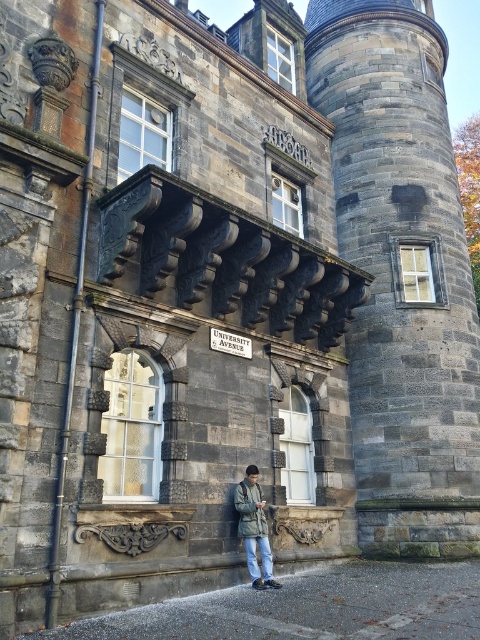
Question: Among these objects, which one is nearest to the camera?

Choices:
 (A) green matte jacket at center
 (B) dark gray stone tower at center

Answer: (A)

Question: Can you confirm if dark gray stone tower at center is wider than green matte jacket at center?

Choices:
 (A) no
 (B) yes

Answer: (B)

Question: Which point appears farthest from the camera in this image?

Choices:
 (A) (242, 484)
 (B) (359, 60)

Answer: (B)

Question: Is dark gray stone tower at center bigger than green matte jacket at center?

Choices:
 (A) no
 (B) yes

Answer: (B)

Question: From the image, what is the correct spatial relationship of dark gray stone tower at center in relation to green matte jacket at center?

Choices:
 (A) right
 (B) left

Answer: (A)